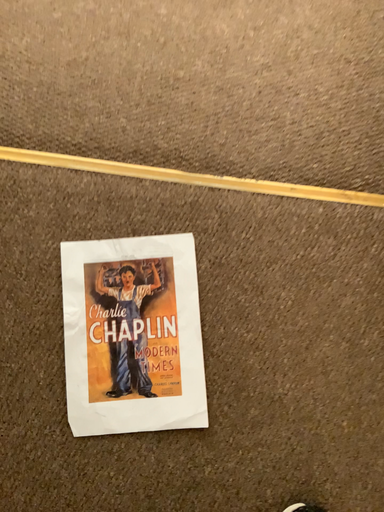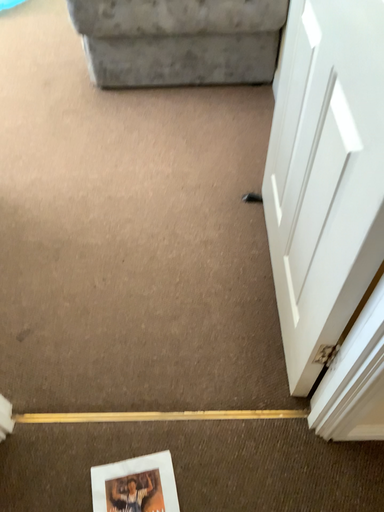
Question: How did the camera likely rotate when shooting the video?

Choices:
 (A) rotated downward
 (B) rotated upward

Answer: (B)